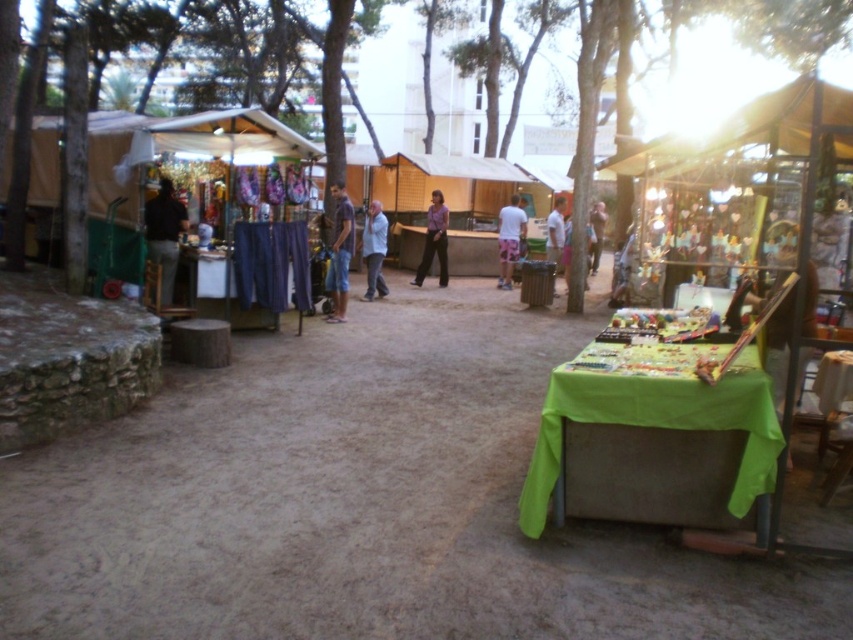
You are standing at the center of the market and see the dark brown leather jacket at left. If you want to reach it quickly, should you walk towards the left or right side of the market?

You should walk towards the left side of the market because the dark brown leather jacket at left is only 8.41 meters away from you, so going left will get you there faster.

You are standing at the point marked as point [433,227] in the image. You want to take a photo of the entire market scene. Is the distance sufficient to capture the whole market in one shot?

The distance of point [433,227] from camera is 15.17 meters, so yes, the distance is sufficient to capture the entire market scene in one shot.

You are standing at the camera position and want to walk to point (x=163, y=301). Is the distance more than 8 meters?

The distance between the camera and point (x=163, y=301) is 8.79 meters, which is more than 8 meters.